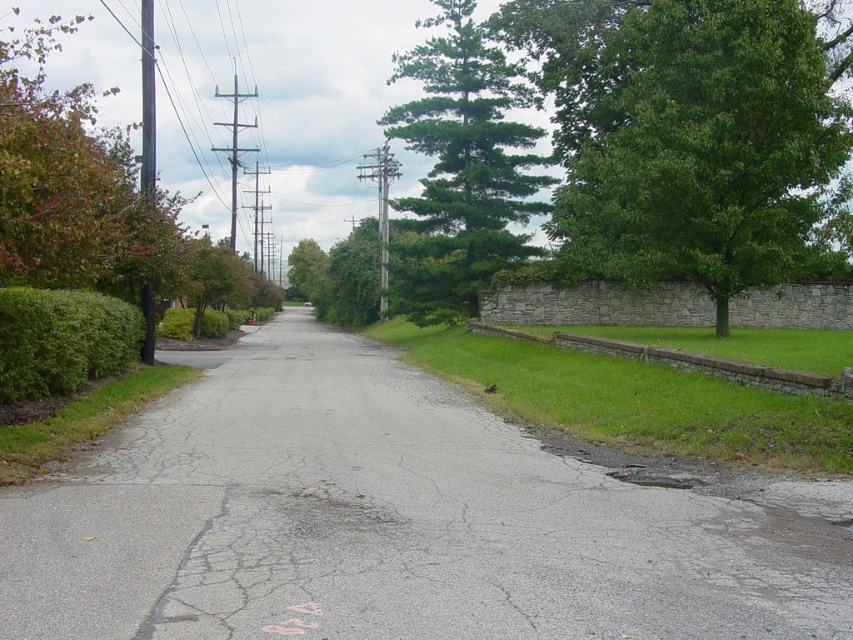
You are a delivery person trying to park your van on the gray asphalt driveway at center. However, there is a green textured pine tree at upper center overhead. Do you think the tree will block the van when you park?

The gray asphalt driveway at center is positioned under the green textured pine tree at upper center, so the tree may block the van when parking. Check the tree branches and height before proceeding.

You are a pedestrian standing at the bottom center of the road where the pink marking is. You want to walk to the green textured pine tree at upper center. Which direction should you head towards while avoiding the green leafy hedge at left?

The green textured pine tree at upper center is positioned over the green leafy hedge at left, so you should head towards the upper center direction away from the left side to reach the pine tree while avoiding the hedge.